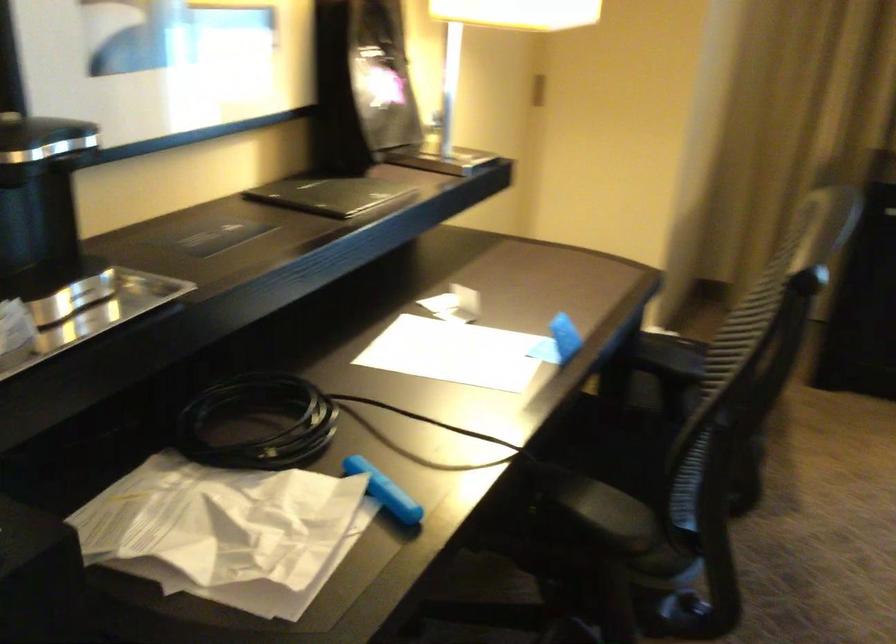
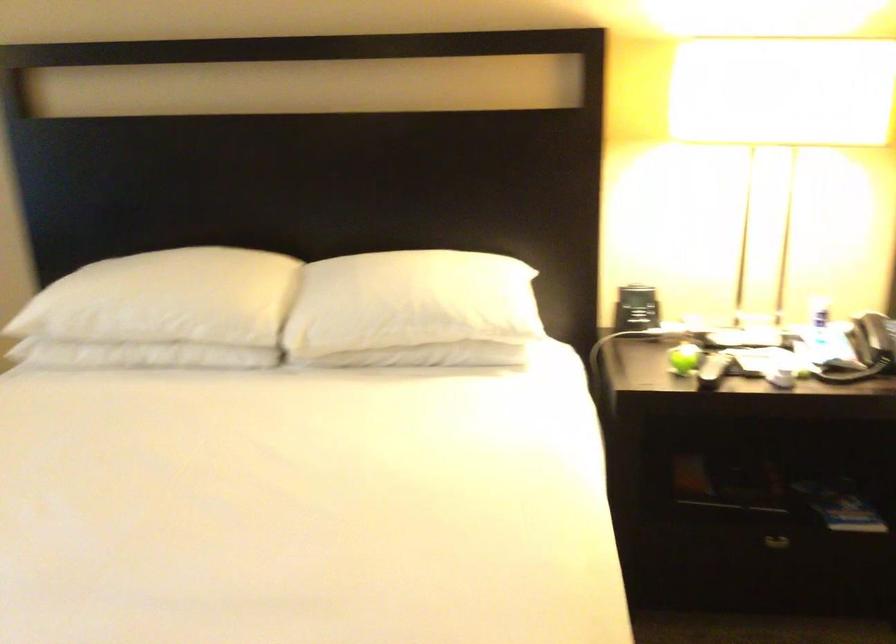
In the scene shown: How did the camera likely rotate?

The camera's rotation is toward right-down.